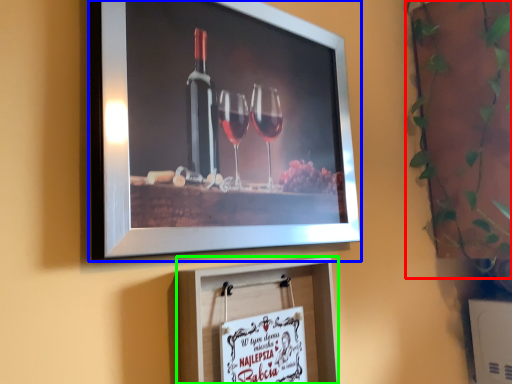
Question: Which object is the closest to the plant (highlighted by a red box)? Choose among these: picture frame (highlighted by a blue box) or picture frame (highlighted by a green box).

Choices:
 (A) picture frame
 (B) picture frame

Answer: (A)